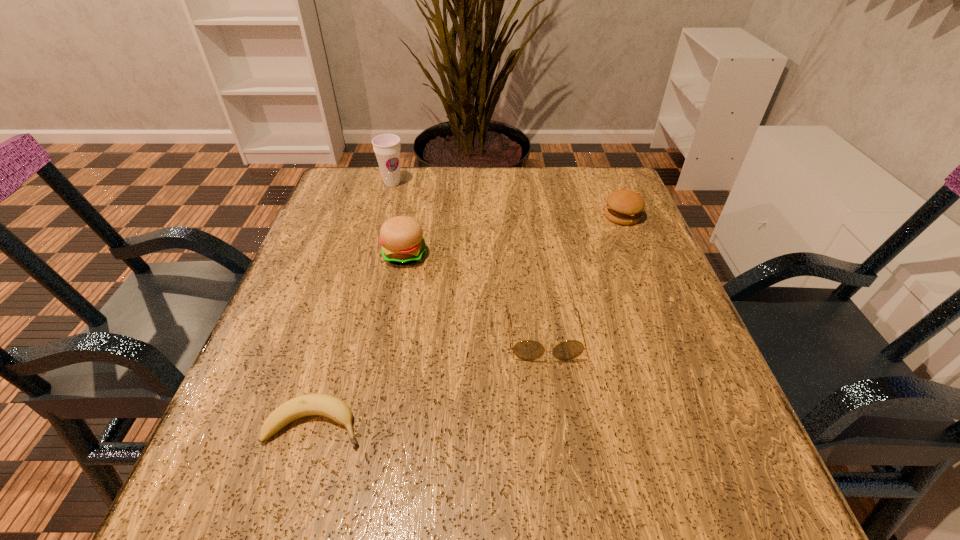
In order to click on the tallest object in this screenshot , I will do `click(387, 147)`.

Image resolution: width=960 pixels, height=540 pixels. I want to click on the farthest object, so click(387, 147).

At what (x,y) coordinates should I click in order to perform the action: click on the nearer hamburger. Please return your answer as a coordinate pair (x, y). Looking at the image, I should click on (401, 237).

Find the location of `the fourth shortest object`. the fourth shortest object is located at coordinates (401, 237).

Find the location of a particular element. the rightmost object is located at coordinates (624, 207).

Image resolution: width=960 pixels, height=540 pixels. Identify the location of the fourth nearest object. coord(624,207).

Locate an element on the screen. the fourth farthest object is located at coordinates (529, 350).

Identify the location of sunglasses. The height and width of the screenshot is (540, 960). (529, 350).

You are a GUI agent. You are given a task and a screenshot of the screen. Output one action in this format:
    pyautogui.click(x=<x>, y=<y>)
    Task: Click on the nearest object
    This screenshot has height=540, width=960.
    Given the screenshot: What is the action you would take?
    pyautogui.click(x=331, y=407)

Where is `banana`? The height and width of the screenshot is (540, 960). banana is located at coordinates pyautogui.click(x=331, y=407).